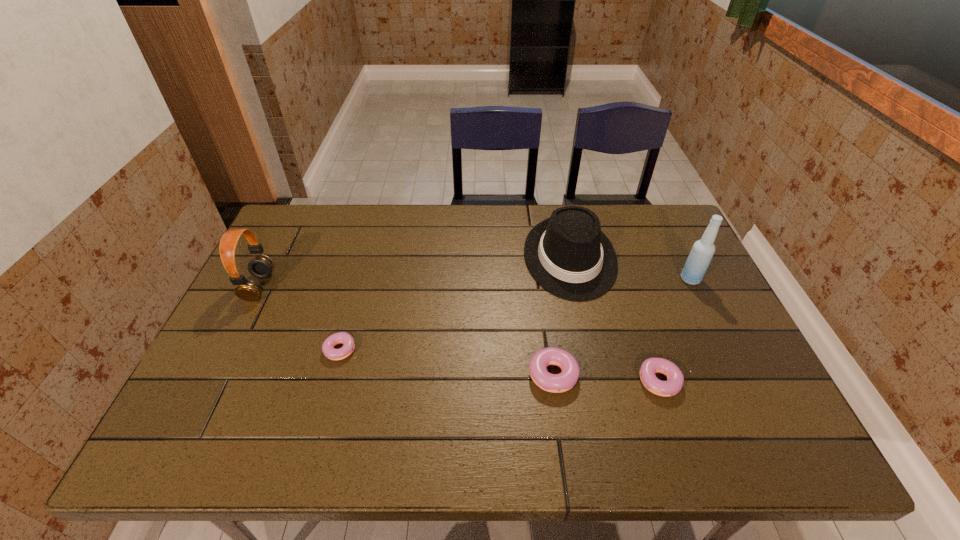
You are a GUI agent. You are given a task and a screenshot of the screen. Output one action in this format:
    pyautogui.click(x=<x>, y=<y>)
    Task: Click on the vacant region at the far edge of the desktop
    The height and width of the screenshot is (540, 960).
    Given the screenshot: What is the action you would take?
    pyautogui.click(x=612, y=237)

You are a GUI agent. You are given a task and a screenshot of the screen. Output one action in this format:
    pyautogui.click(x=<x>, y=<y>)
    Task: Click on the free space at the near edge
    The image size is (960, 540).
    Given the screenshot: What is the action you would take?
    pyautogui.click(x=696, y=394)

In the image, there is a desktop. Where is `vacant space at the left edge`? The height and width of the screenshot is (540, 960). vacant space at the left edge is located at coordinates (287, 293).

At what (x,y) coordinates should I click in order to perform the action: click on free spot at the right edge of the desktop. Please return your answer as a coordinate pair (x, y). The width and height of the screenshot is (960, 540). Looking at the image, I should click on (648, 267).

Where is `free location at the far left corner`? free location at the far left corner is located at coordinates (295, 220).

In the image, there is a desktop. Where is `vacant space at the far right corner`? The height and width of the screenshot is (540, 960). vacant space at the far right corner is located at coordinates (636, 208).

The height and width of the screenshot is (540, 960). I want to click on vacant area that lies between the rightmost object and the second object from left to right, so click(x=516, y=314).

I want to click on free space between the third tallest object and the headset, so click(415, 272).

In order to click on free area in between the headset and the tallest object in this screenshot , I will do `click(475, 283)`.

I want to click on free point between the fedora and the bottle, so click(x=631, y=268).